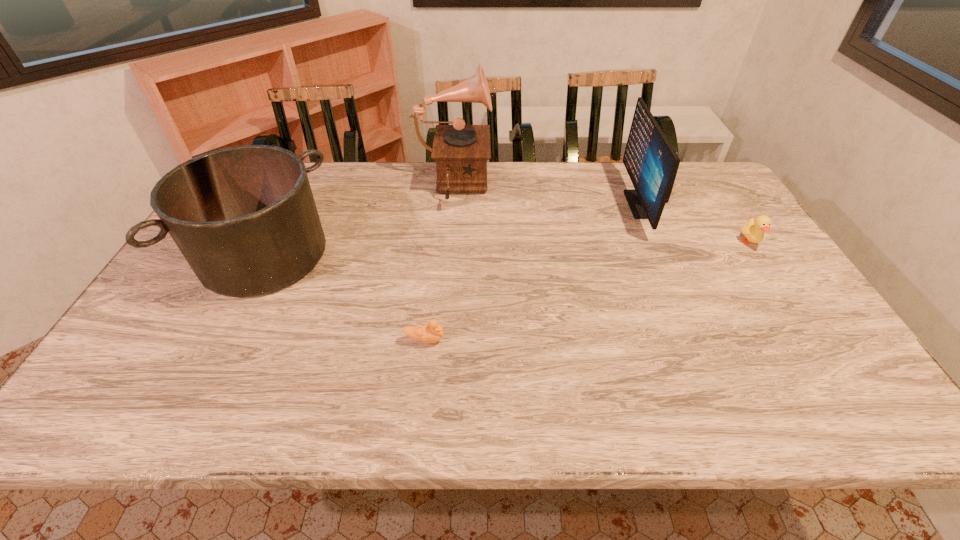
I want to click on free region at the left edge of the desktop, so click(x=135, y=372).

Image resolution: width=960 pixels, height=540 pixels. In order to click on vacant space at the right edge of the desktop in this screenshot , I will do `click(707, 206)`.

The image size is (960, 540). Find the location of `vacant region at the near left corner of the desktop`. vacant region at the near left corner of the desktop is located at coordinates (117, 412).

This screenshot has height=540, width=960. What are the coordinates of `vacant space at the far right corner of the desktop` in the screenshot? It's located at (685, 173).

This screenshot has height=540, width=960. Find the location of `unoccupied area between the second object from right to left and the left duckling`. unoccupied area between the second object from right to left and the left duckling is located at coordinates (533, 272).

You are a GUI agent. You are given a task and a screenshot of the screen. Output one action in this format:
    pyautogui.click(x=<x>, y=<y>)
    Task: Click on the vacant space in between the computer monitor and the record player
    
    Given the screenshot: What is the action you would take?
    pyautogui.click(x=546, y=195)

Image resolution: width=960 pixels, height=540 pixels. Identify the location of free area in between the farther duckling and the second object from right to left. (695, 224).

You are a GUI agent. You are given a task and a screenshot of the screen. Output one action in this format:
    pyautogui.click(x=<x>, y=<y>)
    Task: Click on the unoccupied position between the nearest object and the tallest object
    This screenshot has height=540, width=960.
    Given the screenshot: What is the action you would take?
    pyautogui.click(x=439, y=263)

You are a GUI agent. You are given a task and a screenshot of the screen. Output one action in this format:
    pyautogui.click(x=<x>, y=<y>)
    Task: Click on the unoccupied position between the tallest object and the left duckling
    Image resolution: width=960 pixels, height=540 pixels.
    Given the screenshot: What is the action you would take?
    pyautogui.click(x=439, y=263)

The width and height of the screenshot is (960, 540). I want to click on free space between the computer monitor and the record player, so pyautogui.click(x=546, y=195).